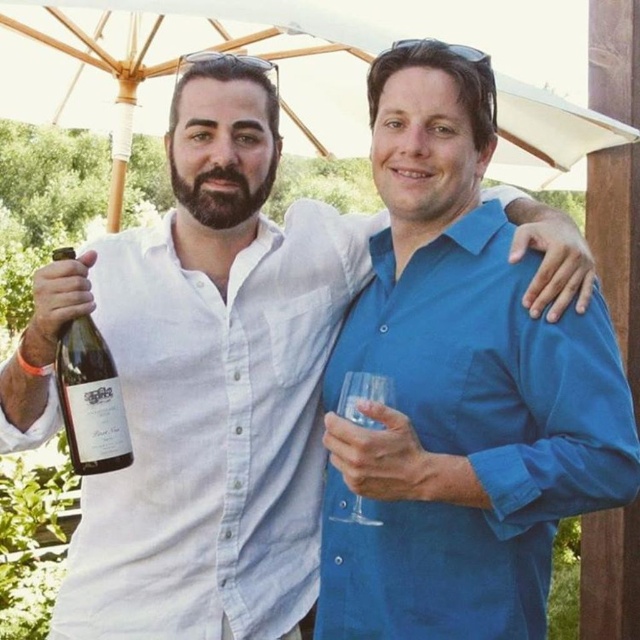
Between white fabric umbrella at upper center and transparent glass at right, which one has more height?

Standing taller between the two is white fabric umbrella at upper center.

Is white fabric umbrella at upper center wider than transparent glass at right?

Yes, white fabric umbrella at upper center is wider than transparent glass at right.

Who is more distant from viewer, [324,48] or [355,504]?

Point [324,48]

Find the location of a particular element. white fabric umbrella at upper center is located at coordinates (209, 22).

Is white fabric umbrella at upper center shorter than translucent glass bottle at left?

Incorrect, white fabric umbrella at upper center's height does not fall short of translucent glass bottle at left's.

Does white fabric umbrella at upper center appear over translucent glass bottle at left?

Indeed, white fabric umbrella at upper center is positioned over translucent glass bottle at left.

Between point (324, 20) and point (77, 449), which one is positioned behind?

Positioned behind is point (324, 20).

The image size is (640, 640). What are the coordinates of `white fabric umbrella at upper center` in the screenshot? It's located at (209, 22).

Who is positioned more to the left, blue cotton shirt at center or translucent glass bottle at left?

Positioned to the left is translucent glass bottle at left.

Between point (493, 600) and point (58, 362), which one is positioned behind?

Point (493, 600)

The image size is (640, 640). What do you see at coordinates (458, 387) in the screenshot?
I see `blue cotton shirt at center` at bounding box center [458, 387].

Where is `blue cotton shirt at center`? blue cotton shirt at center is located at coordinates [458, 387].